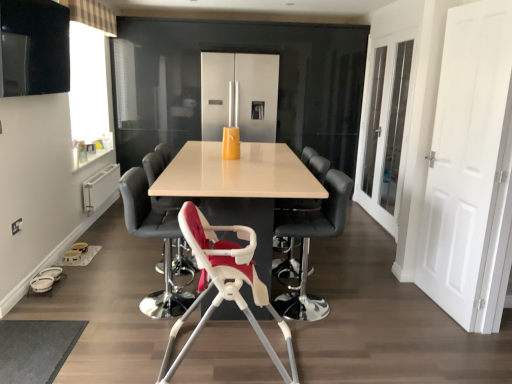
The height and width of the screenshot is (384, 512). I want to click on vacant area to the right of black leather chair at center, the 5th chair in the front-to-back sequence, so click(349, 272).